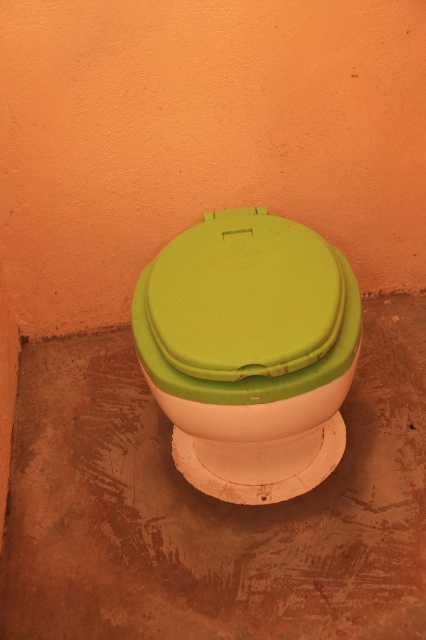
Can you confirm if green matte toilet lid at center is thinner than green matte toilet bowl at center?

Indeed, green matte toilet lid at center has a lesser width compared to green matte toilet bowl at center.

Based on the photo, does green matte toilet lid at center have a lesser height compared to green matte toilet bowl at center?

Yes, green matte toilet lid at center is shorter than green matte toilet bowl at center.

Where is `green matte toilet lid at center`? The width and height of the screenshot is (426, 640). green matte toilet lid at center is located at coordinates (244, 296).